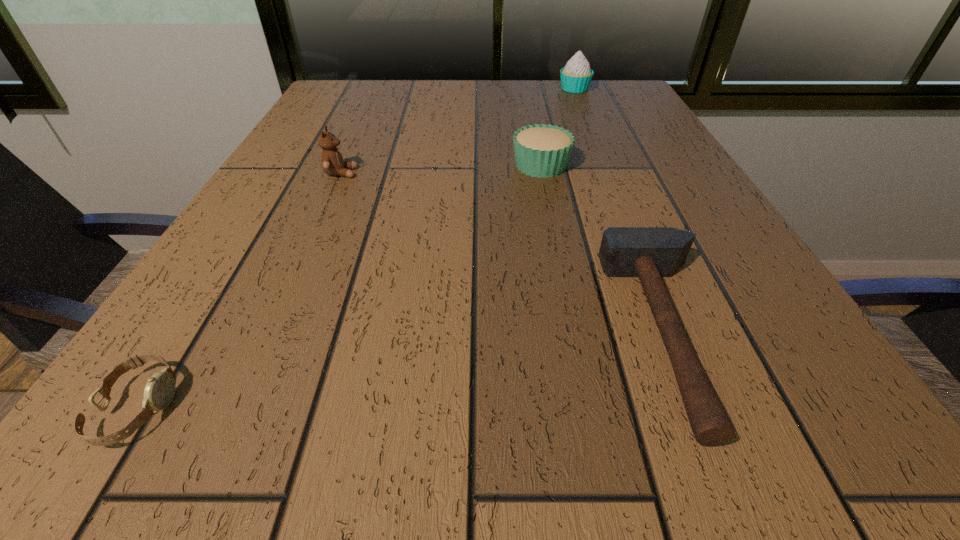
At what (x,y) coordinates should I click in order to perform the action: click on cupcake located in the right edge section of the desktop. Please return your answer as a coordinate pair (x, y). This screenshot has width=960, height=540. Looking at the image, I should click on (576, 76).

In order to click on hammer that is positioned at the right edge in this screenshot , I will do `click(650, 253)`.

This screenshot has width=960, height=540. Find the location of `object that is at the near left corner`. object that is at the near left corner is located at coordinates (159, 391).

Where is `object located at the far right corner`? object located at the far right corner is located at coordinates (576, 76).

This screenshot has height=540, width=960. Find the location of `object present at the near right corner`. object present at the near right corner is located at coordinates (650, 253).

Where is `free space at the far edge`? This screenshot has height=540, width=960. free space at the far edge is located at coordinates (403, 102).

In order to click on free spot at the left edge of the desktop in this screenshot , I will do `click(239, 241)`.

The height and width of the screenshot is (540, 960). I want to click on vacant region at the right edge of the desktop, so click(x=610, y=150).

Find the location of a particular element. The height and width of the screenshot is (540, 960). free region at the far left corner of the desktop is located at coordinates (346, 81).

Locate an element on the screen. Image resolution: width=960 pixels, height=540 pixels. vacant region at the far right corner is located at coordinates (596, 116).